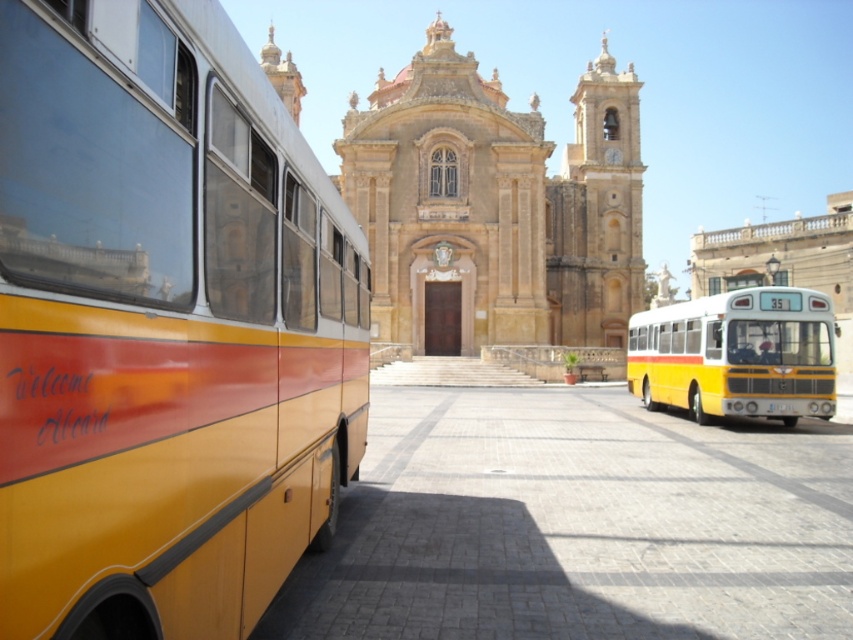
Does golden stone cathedral at center have a greater width compared to yellow matte bus at center?

Yes.

How distant is golden stone cathedral at center from yellow matte bus at center?

A distance of 92.09 feet exists between golden stone cathedral at center and yellow matte bus at center.

Is point (625, 220) closer to viewer compared to point (734, 387)?

No.

Find the location of a particular element. golden stone cathedral at center is located at coordinates (494, 208).

Can you confirm if yellow matte bus at left is wider than yellow matte bus at center?

Incorrect, yellow matte bus at left's width does not surpass yellow matte bus at center's.

Which is above, yellow matte bus at left or yellow matte bus at center?

yellow matte bus at left is higher up.

Where is `yellow matte bus at left`? This screenshot has width=853, height=640. yellow matte bus at left is located at coordinates (164, 324).

Is point (160, 163) farther from viewer compared to point (608, 305)?

No, it is in front of (608, 305).

Find the location of `yellow matte bus at left`. yellow matte bus at left is located at coordinates (164, 324).

What do you see at coordinates (164, 324) in the screenshot?
I see `yellow matte bus at left` at bounding box center [164, 324].

Locate an element on the screen. yellow matte bus at left is located at coordinates (164, 324).